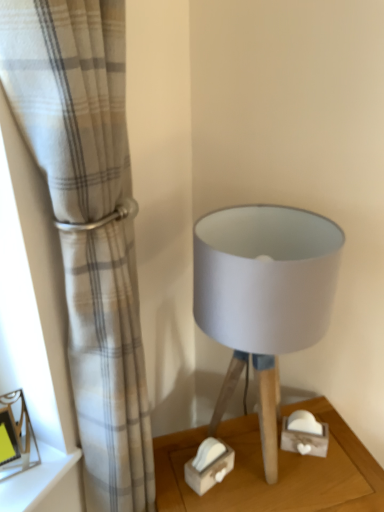
You are a GUI agent. You are given a task and a screenshot of the screen. Output one action in this format:
    pyautogui.click(x=<x>, y=<y>)
    Task: Click on the vacant location below matte gray fabric lampshade at center (from a real-world perspective)
    
    Given the screenshot: What is the action you would take?
    (251, 448)